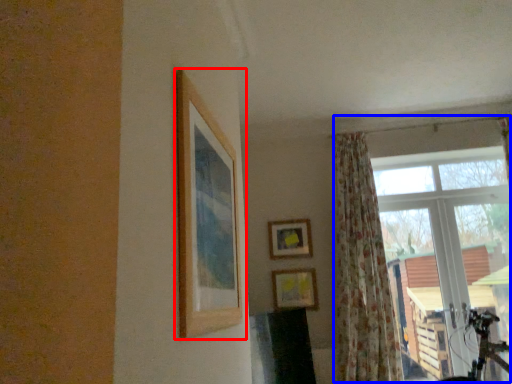
Question: Which point is closer to the camera, picture frame (highlighted by a red box) or window (highlighted by a blue box)?

Choices:
 (A) picture frame
 (B) window

Answer: (A)